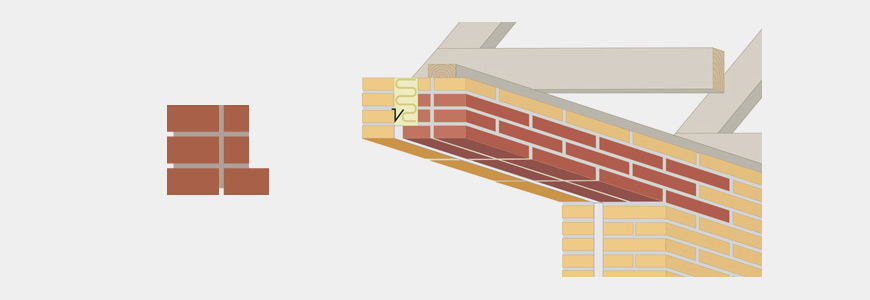
The height and width of the screenshot is (300, 870). Identify the location of right beam. (540, 56).